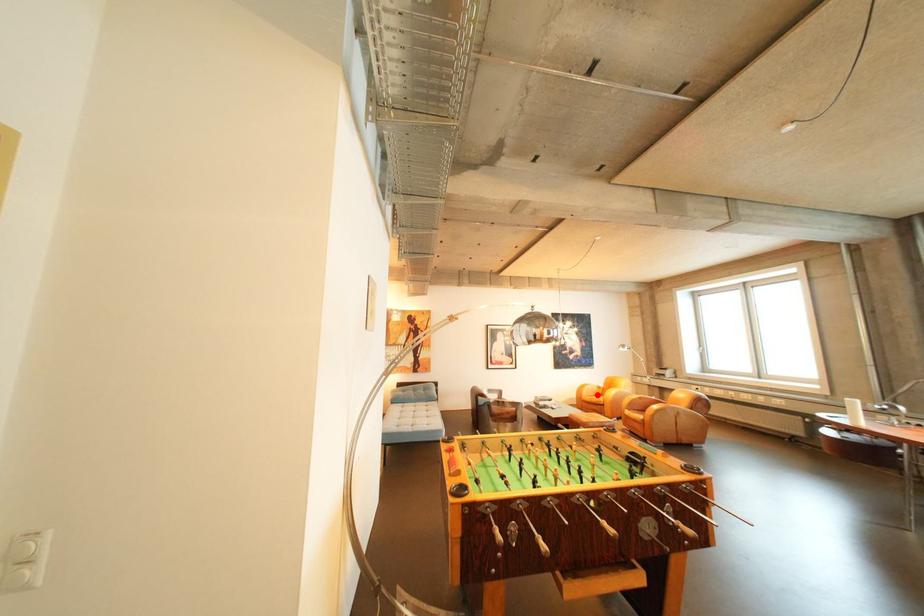
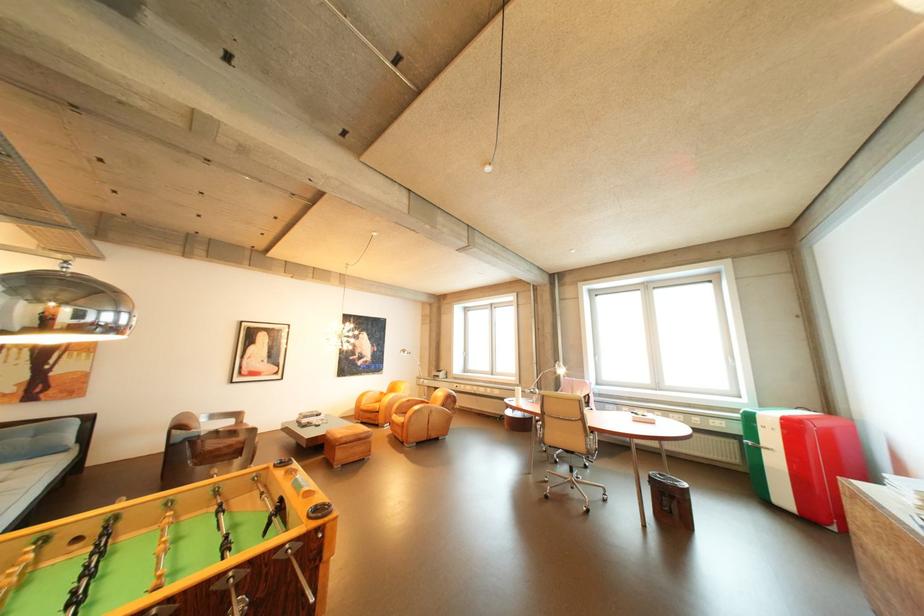
Question: I am providing you with two images of the same scene from different viewpoints. In image1, a red point is highlighted. Considering the same 3D point in image2, which of the following is correct?

Choices:
 (A) It is closer
 (B) It is farther

Answer: (B)